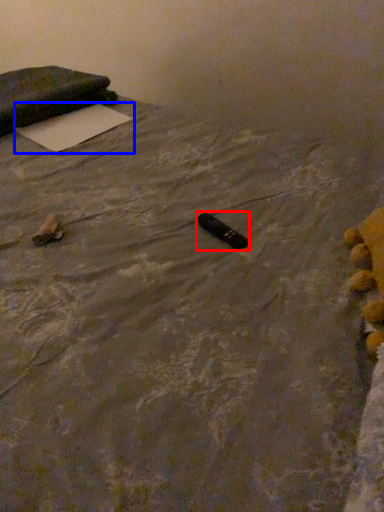
Question: Which point is closer to the camera, waste (highlighted by a red box) or yoga mat (highlighted by a blue box)?

Choices:
 (A) waste
 (B) yoga mat

Answer: (A)